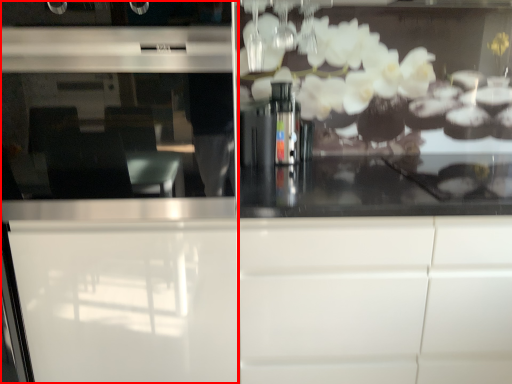
Question: From the image's perspective, where is screen door (annotated by the red box) located in relation to cabinetry in the image?

Choices:
 (A) below
 (B) above

Answer: (B)